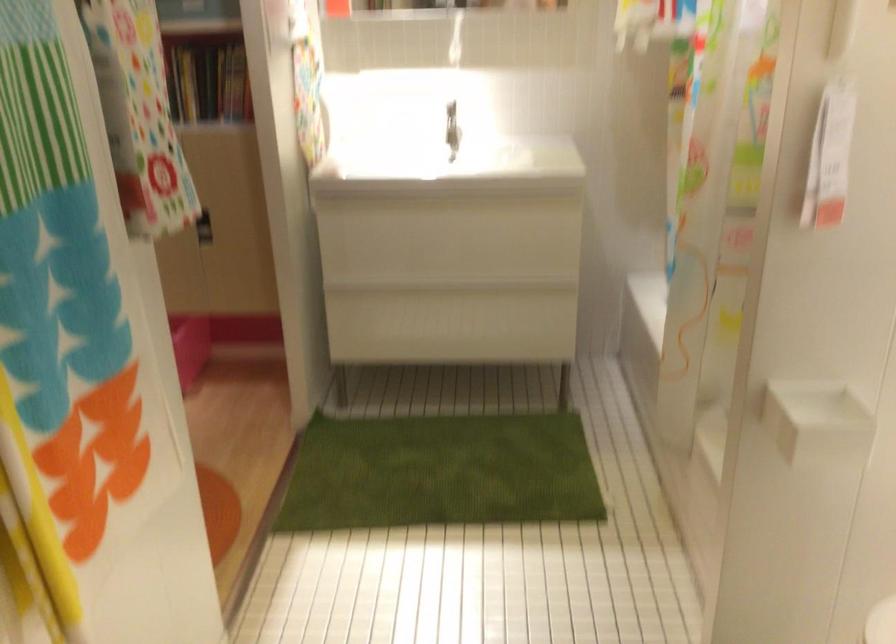
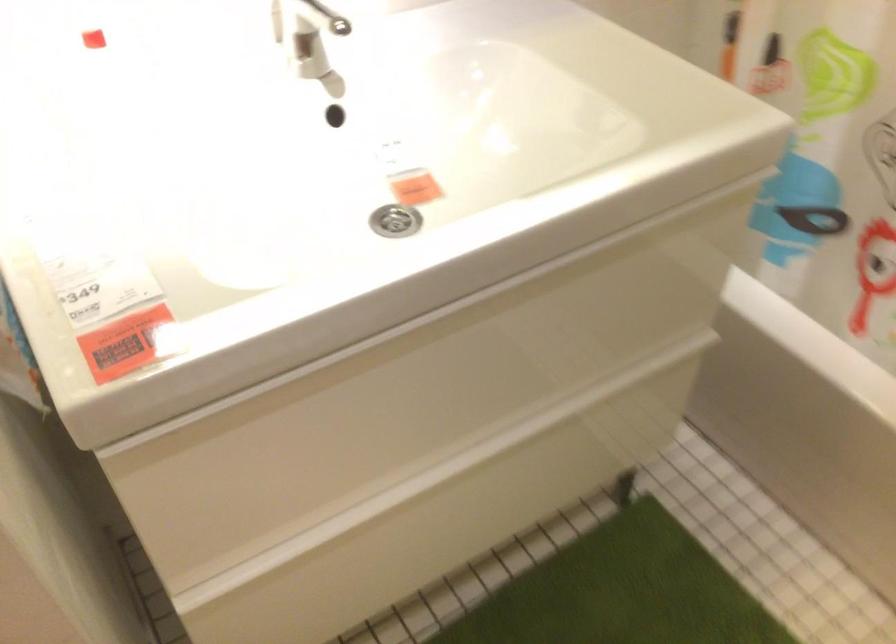
Find the pixel in the second image that matches [384,118] in the first image.

(92, 39)